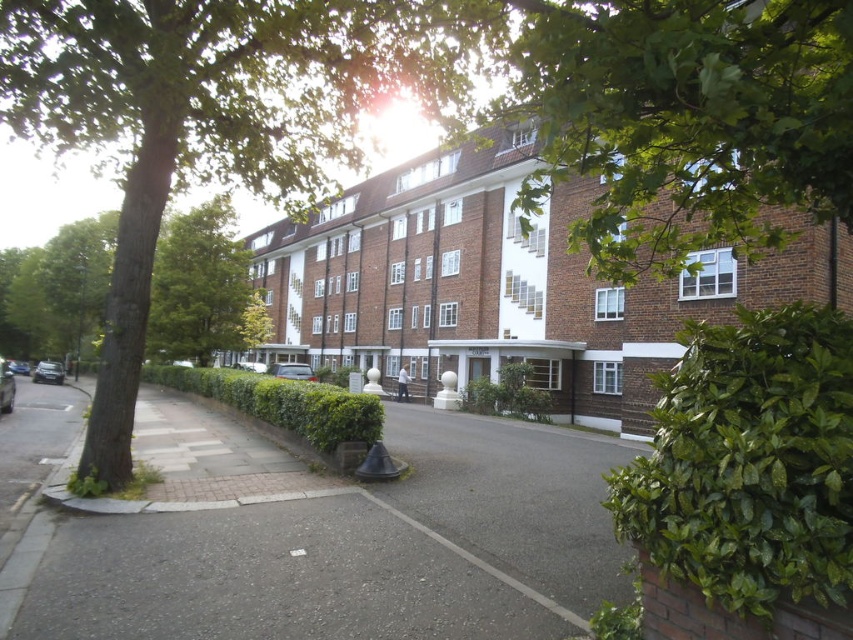
Find the location of a particular element. This screenshot has width=853, height=640. green leafy tree at center is located at coordinates (202, 288).

Between green leafy tree at center and green leafy tree at left, which one appears on the left side from the viewer's perspective?

Positioned to the left is green leafy tree at left.

What do you see at coordinates (202, 288) in the screenshot? I see `green leafy tree at center` at bounding box center [202, 288].

The image size is (853, 640). I want to click on green leafy tree at center, so click(x=202, y=288).

Is green leafy tree at center taller than green leafy hedge at center?

Yes, green leafy tree at center is taller than green leafy hedge at center.

The height and width of the screenshot is (640, 853). What do you see at coordinates (202, 288) in the screenshot? I see `green leafy tree at center` at bounding box center [202, 288].

The image size is (853, 640). What are the coordinates of `green leafy tree at center` in the screenshot? It's located at (202, 288).

Is green leafy hedge at lower right behind green leafy tree at center?

That is False.

Who is lower down, green leafy hedge at lower right or green leafy tree at center?

green leafy hedge at lower right is lower down.

Image resolution: width=853 pixels, height=640 pixels. I want to click on green leafy hedge at lower right, so pyautogui.click(x=746, y=483).